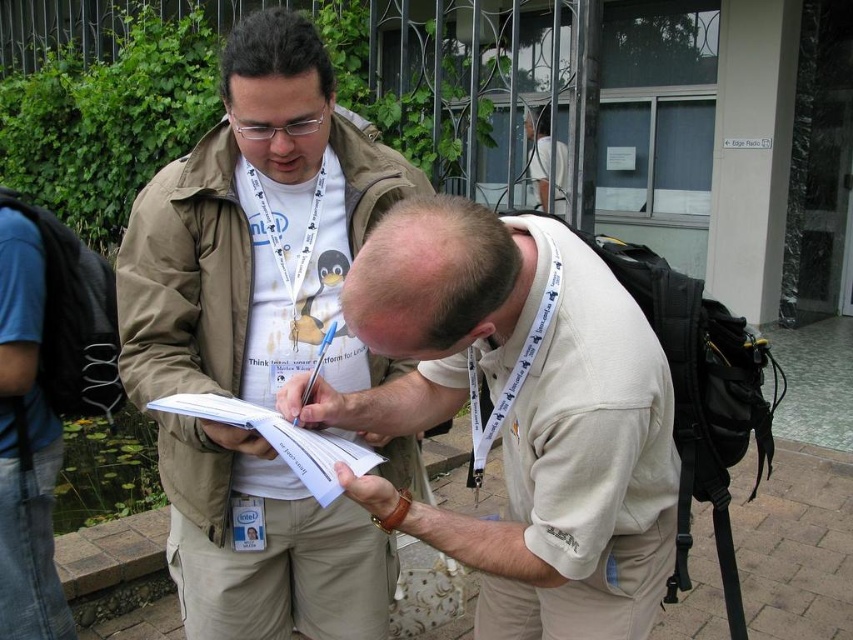
You are standing at the point labeled point (619, 465) and want to move to the point labeled point (25, 472). Given that your field of view is limited to 10 meters, will you be able to see the destination point while moving towards it?

Point (619, 465) is closer to the viewer than point (25, 472). Since the destination point is further away, you might lose sight of it as you move closer to it, depending on the environment. However, the field of view limit of 10 meters isn

You are a photographer trying to capture a candid shot of the beige cotton shirt at center and the blue denim jeans at lower left. To ensure both are in frame, you need to know their heights. Which object is taller?

The blue denim jeans at lower left is taller than the beige cotton shirt at center.

You are a photographer standing in front of the scene. You need to position a light source so that it illuminates both the beige cotton shirt at center and the white paper at center equally. Given their relative heights, where should you place the light source?

A: Since the beige cotton shirt at center is taller than the white paper at center, the light source should be placed lower to ensure both receive equal illumination.